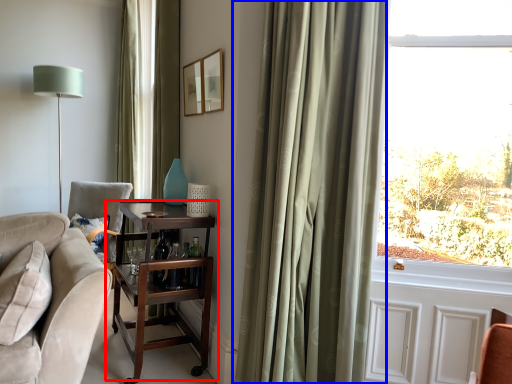
Question: Which object is further to the camera taking this photo, table (highlighted by a red box) or curtain (highlighted by a blue box)?

Choices:
 (A) table
 (B) curtain

Answer: (A)